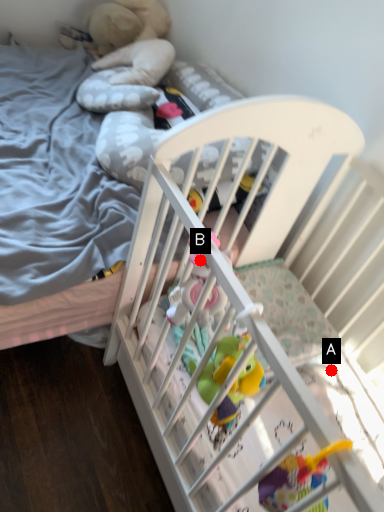
Question: Two points are circled on the image, labeled by A and B beside each circle. Which point is closer to the camera taking this photo?

Choices:
 (A) A is closer
 (B) B is closer

Answer: (B)